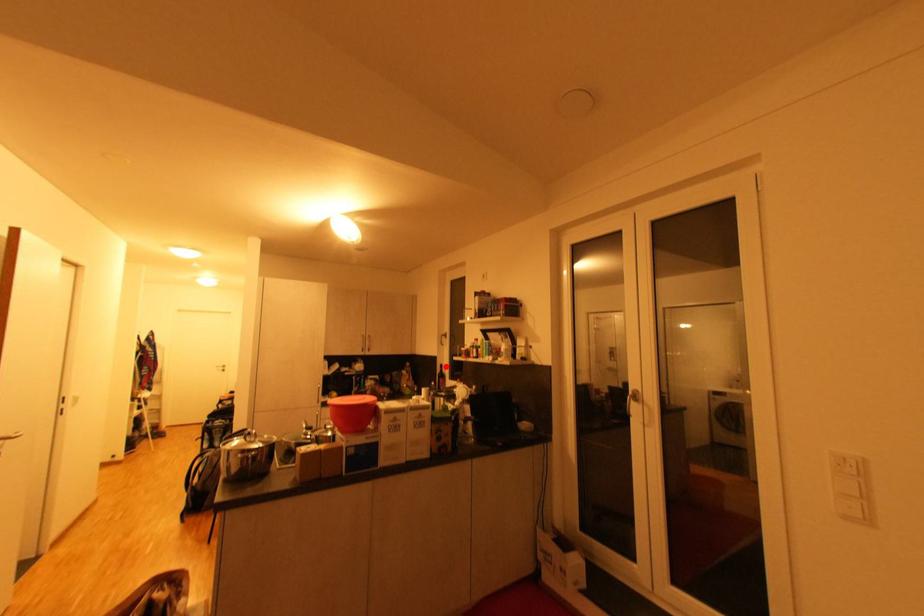
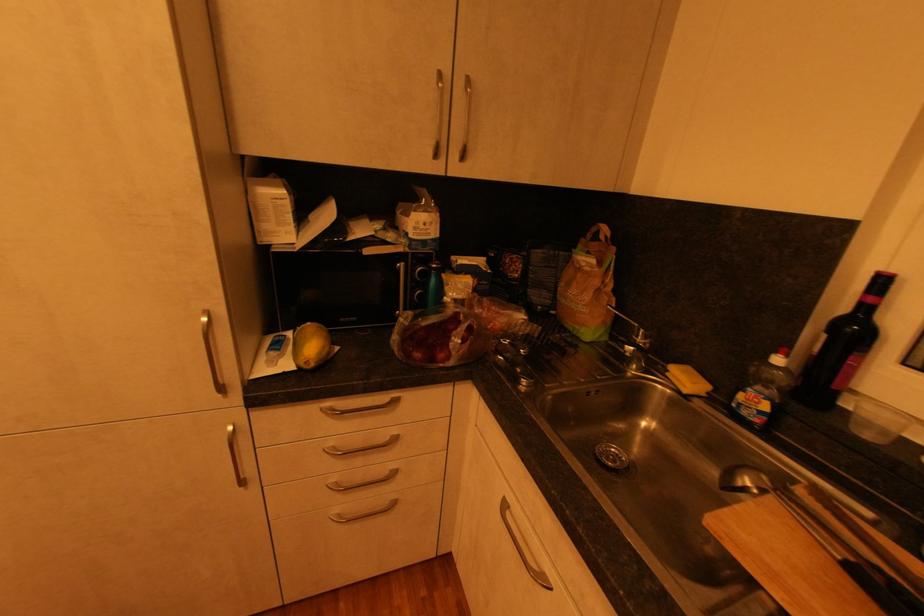
Locate, in the second image, the point that corresponds to the highlighted location in the first image.

(889, 282)